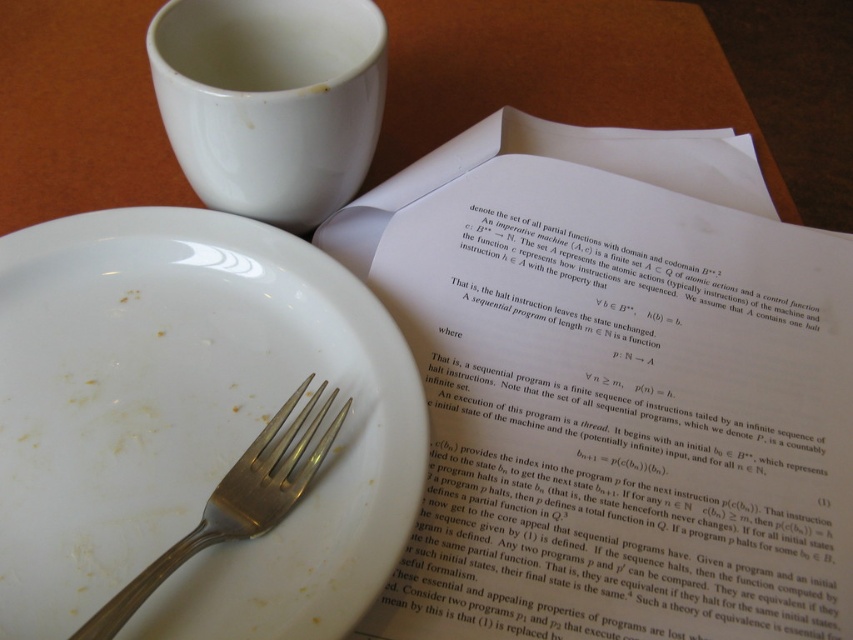
You are setting up a table for a meeting. You have a white paper at upper center and a white glossy mug at upper center. Where should you place the mug to avoid covering the paper?

The white glossy mug at upper center should be placed above the white paper at upper center to avoid covering it since the white paper is currently positioned under the mug.

You are a waiter looking at the table setting. The white glossy plate at lower left needs to be cleaned. Where exactly is it located on the table in terms of coordinates?

The white glossy plate at lower left is located at coordinates point (x=190, y=424).